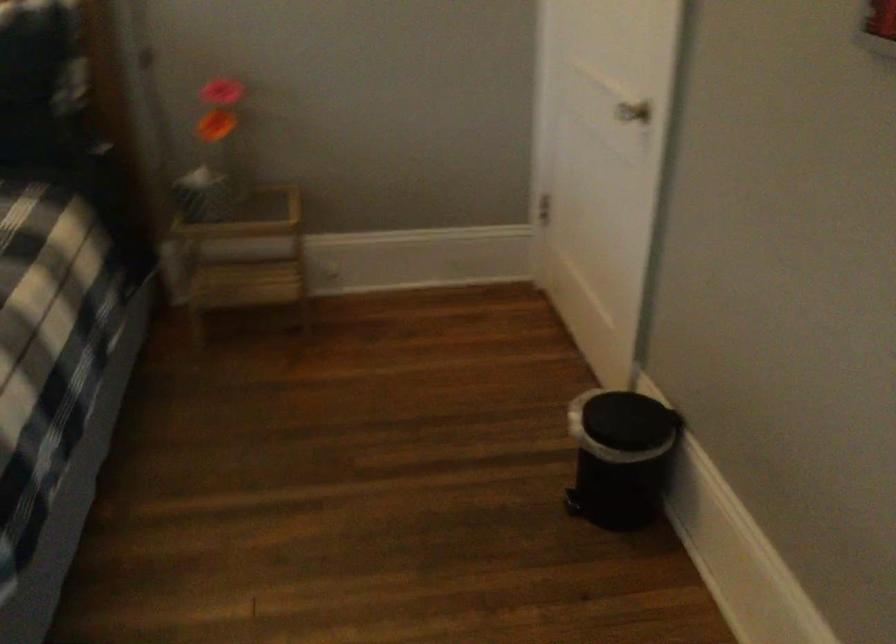
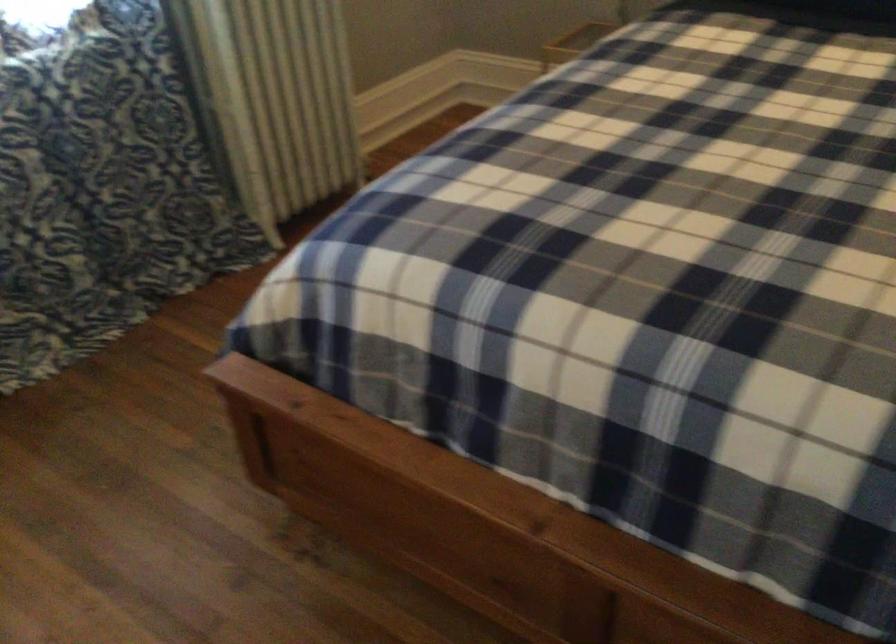
Question: The first image is from the beginning of the video and the second image is from the end. How did the camera likely rotate when shooting the video?

Choices:
 (A) Left
 (B) Right
 (C) Up
 (D) Down

Answer: (A)